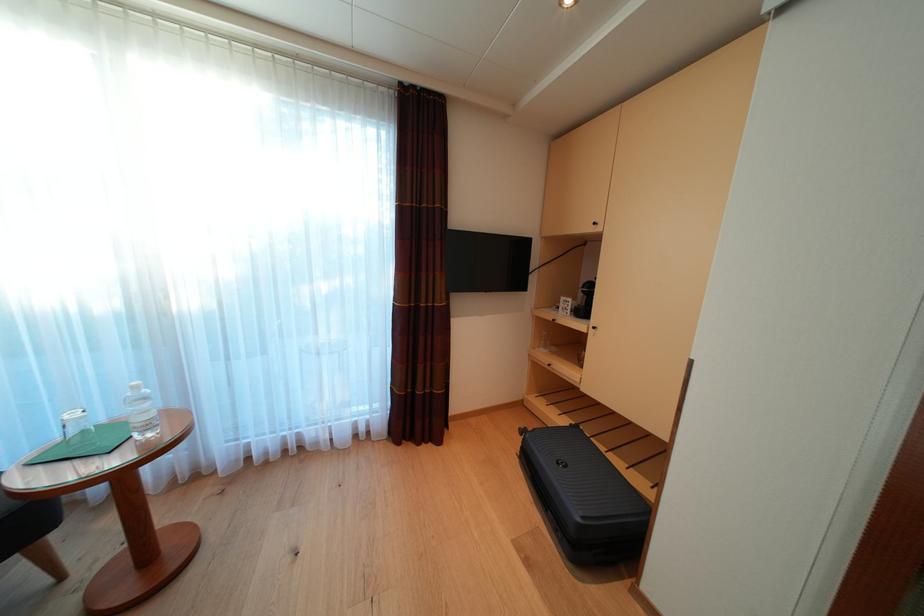
The image size is (924, 616). In order to click on brown curtain edge in this screenshot , I will do `click(419, 98)`.